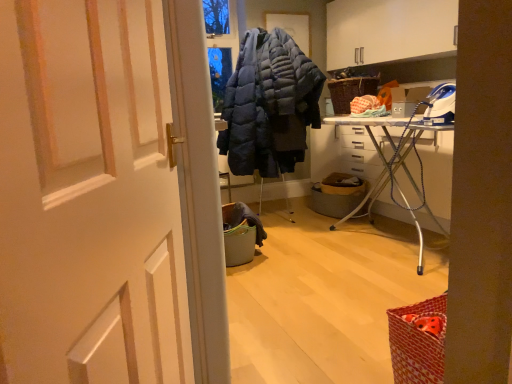
Question: Considering the relative sizes of white matte door at center and metallic gray laundry basket at center in the image provided, is white matte door at center smaller than metallic gray laundry basket at center?

Choices:
 (A) yes
 (B) no

Answer: (B)

Question: Considering the relative sizes of white matte door at center and metallic gray laundry basket at center in the image provided, is white matte door at center taller than metallic gray laundry basket at center?

Choices:
 (A) no
 (B) yes

Answer: (B)

Question: From a real-world perspective, is white matte door at center on top of metallic gray laundry basket at center?

Choices:
 (A) yes
 (B) no

Answer: (A)

Question: Is white matte door at center turned away from metallic gray laundry basket at center?

Choices:
 (A) yes
 (B) no

Answer: (B)

Question: Can you confirm if white matte door at center is positioned to the left of metallic gray laundry basket at center?

Choices:
 (A) no
 (B) yes

Answer: (B)

Question: Does white matte door at center have a lesser height compared to metallic gray laundry basket at center?

Choices:
 (A) no
 (B) yes

Answer: (A)

Question: Is white metal ironing board at center right thinner than metallic gray laundry basket at center?

Choices:
 (A) no
 (B) yes

Answer: (A)

Question: Considering the relative sizes of white metal ironing board at center right and metallic gray laundry basket at center in the image provided, is white metal ironing board at center right smaller than metallic gray laundry basket at center?

Choices:
 (A) yes
 (B) no

Answer: (B)

Question: Does white metal ironing board at center right appear on the left side of metallic gray laundry basket at center?

Choices:
 (A) no
 (B) yes

Answer: (A)

Question: Considering the relative sizes of white metal ironing board at center right and metallic gray laundry basket at center in the image provided, is white metal ironing board at center right wider than metallic gray laundry basket at center?

Choices:
 (A) yes
 (B) no

Answer: (A)

Question: Considering the relative positions of white metal ironing board at center right and metallic gray laundry basket at center in the image provided, is white metal ironing board at center right behind metallic gray laundry basket at center?

Choices:
 (A) yes
 (B) no

Answer: (B)

Question: From a real-world perspective, is white metal ironing board at center right below metallic gray laundry basket at center?

Choices:
 (A) no
 (B) yes

Answer: (A)

Question: From a real-world perspective, is white metal ironing board at center right located beneath dark blue quilted jacket at center?

Choices:
 (A) yes
 (B) no

Answer: (A)